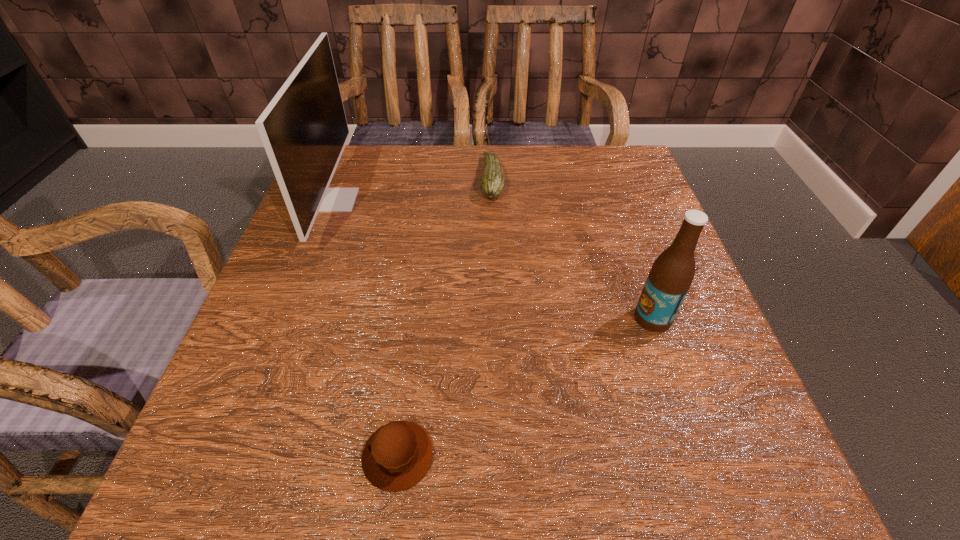
Locate an element on the screen. The image size is (960, 540). vacant point located between the muffin and the third object from left to right is located at coordinates (445, 318).

At what (x,y) coordinates should I click in order to perform the action: click on empty space between the third object from right to left and the rightmost object. Please return your answer as a coordinate pair (x, y). Looking at the image, I should click on (525, 387).

The width and height of the screenshot is (960, 540). I want to click on unoccupied position between the zucchini and the third shortest object, so click(x=572, y=249).

Find the location of a particular element. This screenshot has height=540, width=960. vacant space that is in between the third object from left to right and the third farthest object is located at coordinates (572, 249).

The height and width of the screenshot is (540, 960). I want to click on vacant point located between the second tallest object and the third object from left to right, so click(572, 249).

The width and height of the screenshot is (960, 540). I want to click on free space between the third object from right to left and the tallest object, so click(367, 328).

The width and height of the screenshot is (960, 540). In order to click on the second closest object relative to the zucchini in this screenshot , I will do `click(671, 275)`.

Identify the location of object that is the nearest to the monitor. (492, 185).

I want to click on vacant region that satisfies the following two spatial constraints: 1. on the front-facing side of the monitor; 2. on the back side of the nearest object, so click(236, 456).

The height and width of the screenshot is (540, 960). Find the location of `vacant space that satisfies the following two spatial constraints: 1. on the back side of the second nearest object; 2. at the stem end of the second object from right to left`. vacant space that satisfies the following two spatial constraints: 1. on the back side of the second nearest object; 2. at the stem end of the second object from right to left is located at coordinates (605, 179).